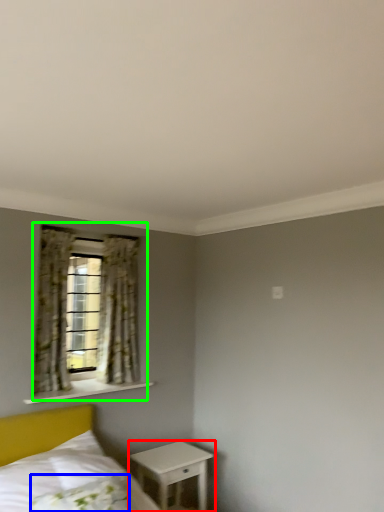
Question: Which is farther away from nightstand (highlighted by a red box)? pillow (highlighted by a blue box) or window (highlighted by a green box)?

Choices:
 (A) pillow
 (B) window

Answer: (B)